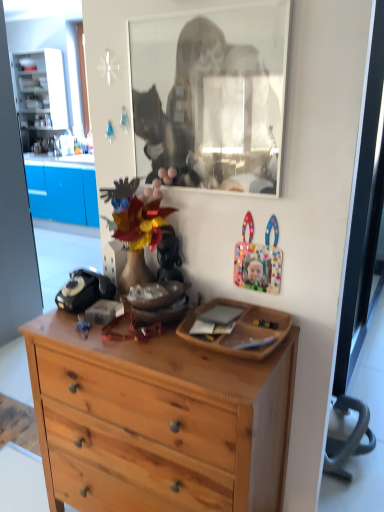
Where is `black glass mirror at upper center`? This screenshot has width=384, height=512. black glass mirror at upper center is located at coordinates (211, 96).

Image resolution: width=384 pixels, height=512 pixels. What do you see at coordinates (211, 96) in the screenshot? I see `black glass mirror at upper center` at bounding box center [211, 96].

What do you see at coordinates (169, 256) in the screenshot? I see `matte plastic mask at center` at bounding box center [169, 256].

Where is `black glass mirror at upper center`? This screenshot has width=384, height=512. black glass mirror at upper center is located at coordinates (211, 96).

Based on the photo, is natural wood dresser at center to the left of black glass mirror at upper center from the viewer's perspective?

Indeed, natural wood dresser at center is positioned on the left side of black glass mirror at upper center.

Can you confirm if natural wood dresser at center is shorter than black glass mirror at upper center?

No.

Is natural wood dresser at center positioned beyond the bounds of black glass mirror at upper center?

Yes, natural wood dresser at center is outside of black glass mirror at upper center.

Can you confirm if natural wood dresser at center is thinner than black glass mirror at upper center?

No, natural wood dresser at center is not thinner than black glass mirror at upper center.

Can you see natural wood dresser at center touching matte plastic mask at center?

natural wood dresser at center and matte plastic mask at center are clearly separated.

Looking at this image, from the image's perspective, is natural wood dresser at center under matte plastic mask at center?

Indeed, from the image's perspective, natural wood dresser at center is shown beneath matte plastic mask at center.

In the scene shown: From a real-world perspective, is natural wood dresser at center above or below matte plastic mask at center?

In terms of real-world spatial position, natural wood dresser at center is below matte plastic mask at center.

Could you tell me if wooden tray at center is turned towards natural wood dresser at center?

No, wooden tray at center is not aimed at natural wood dresser at center.

Looking at this image, which object is positioned more to the left, wooden tray at center or natural wood dresser at center?

natural wood dresser at center is more to the left.

Is wooden tray at center spatially inside natural wood dresser at center, or outside of it?

wooden tray at center exists outside the volume of natural wood dresser at center.

From the image's perspective, is wooden tray at center above natural wood dresser at center?

Yes, from the image's perspective, wooden tray at center is over natural wood dresser at center.

From a real-world perspective, is matte plastic mask at center physically above natural wood dresser at center?

Yes, from a real-world perspective, matte plastic mask at center is on top of natural wood dresser at center.

Considering the relative sizes of matte plastic mask at center and natural wood dresser at center in the image provided, is matte plastic mask at center wider than natural wood dresser at center?

No, matte plastic mask at center is not wider than natural wood dresser at center.

This screenshot has width=384, height=512. Identify the location of toy behind the natural wood dresser at center. (169, 256).

Looking at this image, would you say natural wood dresser at center is part of matte plastic mask at center's contents?

No, matte plastic mask at center does not contain natural wood dresser at center.

Find the location of `mirror located on the right of matte plastic mask at center`. mirror located on the right of matte plastic mask at center is located at coordinates (211, 96).

Considering the points (158, 262) and (182, 97), which point is behind, point (158, 262) or point (182, 97)?

Point (158, 262)

In the scene shown: Can you confirm if matte plastic mask at center is bigger than black glass mirror at upper center?

Incorrect, matte plastic mask at center is not larger than black glass mirror at upper center.

Considering the sizes of black glass mirror at upper center and matte plastic mask at center in the image, is black glass mirror at upper center wider or thinner than matte plastic mask at center?

Considering their sizes, black glass mirror at upper center looks slimmer than matte plastic mask at center.

How much distance is there between black glass mirror at upper center and matte plastic mask at center?

They are 43.58 centimeters apart.

Between black glass mirror at upper center and matte plastic mask at center, which one has smaller size?

Smaller between the two is matte plastic mask at center.

Which is closer to the camera, [248,160] or [169,234]?

Point [248,160] is closer to the camera than point [169,234].

Which is more to the left, matte plastic mask at center or wooden tray at center?

From the viewer's perspective, matte plastic mask at center appears more on the left side.

Considering the relative positions of matte plastic mask at center and wooden tray at center in the image provided, is matte plastic mask at center behind wooden tray at center?

Yes, it is.

Between matte plastic mask at center and wooden tray at center, which one has less height?

wooden tray at center is shorter.

In order to click on desk that is in front of the black glass mirror at upper center in this screenshot , I will do `click(158, 421)`.

Where is `desk below the matte plastic mask at center (from the image's perspective)`? The image size is (384, 512). desk below the matte plastic mask at center (from the image's perspective) is located at coordinates (158, 421).

Looking at the image, which one is located closer to natural wood dresser at center, wooden tray at center or black glass mirror at upper center?

wooden tray at center is closer to natural wood dresser at center.

Based on their spatial positions, is wooden tray at center or black glass mirror at upper center closer to matte plastic mask at center?

wooden tray at center lies closer to matte plastic mask at center than the other object.

Looking at the image, which one is located closer to black glass mirror at upper center, wooden tray at center or matte plastic mask at center?

Based on the image, matte plastic mask at center appears to be nearer to black glass mirror at upper center.

Which object lies further to the anchor point natural wood dresser at center, wooden tray at center or matte plastic mask at center?

matte plastic mask at center is positioned further to the anchor natural wood dresser at center.

When comparing their distances from wooden tray at center, does matte plastic mask at center or black glass mirror at upper center seem closer?

matte plastic mask at center is closer to wooden tray at center.

Based on their spatial positions, is natural wood dresser at center or matte plastic mask at center further from black glass mirror at upper center?

natural wood dresser at center.

Which object lies further to the anchor point black glass mirror at upper center, matte plastic mask at center or natural wood dresser at center?

Based on the image, natural wood dresser at center appears to be further to black glass mirror at upper center.

Based on their spatial positions, is wooden tray at center or natural wood dresser at center further from black glass mirror at upper center?

The object further to black glass mirror at upper center is natural wood dresser at center.

Image resolution: width=384 pixels, height=512 pixels. What are the coordinates of `toy between black glass mirror at upper center and natural wood dresser at center from top to bottom` in the screenshot? It's located at (169, 256).

Where is `picture frame between black glass mirror at upper center and natural wood dresser at center from top to bottom`? The image size is (384, 512). picture frame between black glass mirror at upper center and natural wood dresser at center from top to bottom is located at coordinates (240, 329).

Identify the location of toy between black glass mirror at upper center and wooden tray at center from top to bottom. This screenshot has height=512, width=384. (169, 256).

This screenshot has width=384, height=512. I want to click on picture frame between matte plastic mask at center and natural wood dresser at center vertically, so click(x=240, y=329).